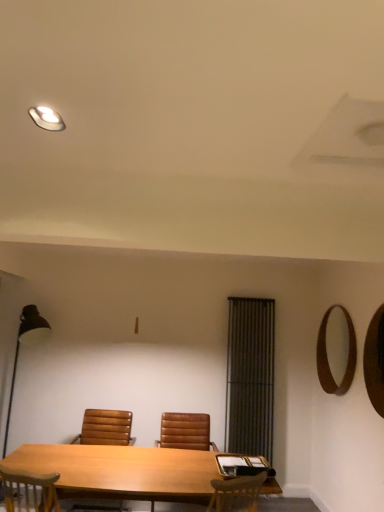
You are a GUI agent. You are given a task and a screenshot of the screen. Output one action in this format:
    pyautogui.click(x=<x>, y=<y>)
    Task: Click on the vacant space situated above light brown wood table at center (from a real-world perspective)
    This screenshot has height=512, width=384.
    Given the screenshot: What is the action you would take?
    pyautogui.click(x=125, y=465)